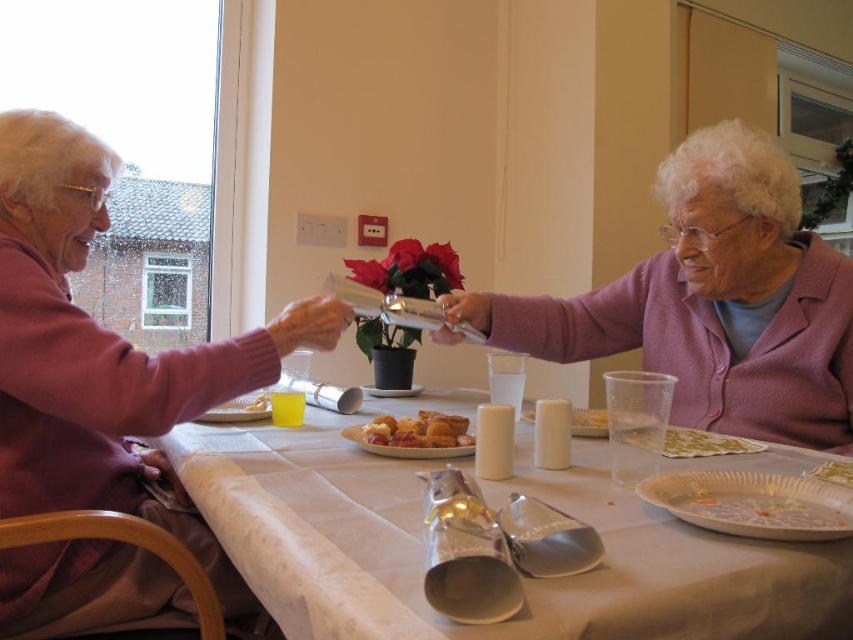
Question: Is matte purple sweater at left to the left of golden textured bread at lower right from the viewer's perspective?

Choices:
 (A) no
 (B) yes

Answer: (B)

Question: Based on their relative distances, which object is farther from the golden brown croissant at center?

Choices:
 (A) matte purple sweater at left
 (B) metallic silver foil at center

Answer: (A)

Question: Among these objects, which one is farthest from the camera?

Choices:
 (A) white paper plate at lower right
 (B) pink knitted sweater at upper right
 (C) matte purple sweater at left
 (D) golden-brown crispy pastry at center

Answer: (B)

Question: Among these objects, which one is nearest to the camera?

Choices:
 (A) pink knitted sweater at upper right
 (B) white paper plate at lower right
 (C) golden brown croissant at center
 (D) golden-brown crispy pastry at center

Answer: (B)

Question: Does golden textured bread at lower right appear on the left side of white ceramic plate at center?

Choices:
 (A) no
 (B) yes

Answer: (A)

Question: Is metallic silver foil at center smaller than pink knitted sweater at upper right?

Choices:
 (A) yes
 (B) no

Answer: (A)